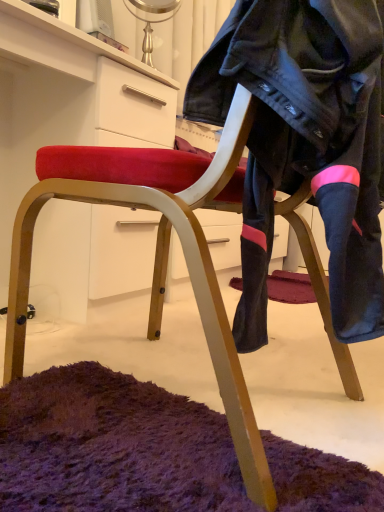
What are the coordinates of `black leather jacket at center` in the screenshot? It's located at (305, 144).

The height and width of the screenshot is (512, 384). What do you see at coordinates (305, 144) in the screenshot?
I see `black leather jacket at center` at bounding box center [305, 144].

Locate an element on the screen. This screenshot has width=384, height=512. velvet red chair at lower left is located at coordinates tap(66, 102).

This screenshot has width=384, height=512. What do you see at coordinates (66, 102) in the screenshot?
I see `velvet red chair at lower left` at bounding box center [66, 102].

This screenshot has width=384, height=512. What are the coordinates of `black leather jacket at center` in the screenshot? It's located at (305, 144).

Does black leather jacket at center appear on the right side of velvet red chair at lower left?

Indeed, black leather jacket at center is positioned on the right side of velvet red chair at lower left.

Which is in front, black leather jacket at center or velvet red chair at lower left?

black leather jacket at center is more forward.

Is point (357, 209) more distant than point (75, 295)?

That is False.

From the image's perspective, which object appears higher, black leather jacket at center or velvet red chair at lower left?

velvet red chair at lower left.

From a real-world perspective, who is located lower, black leather jacket at center or velvet red chair at lower left?

In real-world perspective, velvet red chair at lower left is lower.

Is black leather jacket at center wider than velvet red chair at lower left?

In fact, black leather jacket at center might be narrower than velvet red chair at lower left.

Considering the sizes of black leather jacket at center and velvet red chair at lower left in the image, is black leather jacket at center taller or shorter than velvet red chair at lower left?

Considering their sizes, black leather jacket at center has less height than velvet red chair at lower left.

In terms of size, does black leather jacket at center appear bigger or smaller than velvet red chair at lower left?

black leather jacket at center is smaller than velvet red chair at lower left.

Does black leather jacket at center contain velvet red chair at lower left?

That's incorrect, velvet red chair at lower left is not inside black leather jacket at center.

Would you consider black leather jacket at center to be distant from velvet red chair at lower left?

No, black leather jacket at center is not far from velvet red chair at lower left.

Is black leather jacket at center facing towards velvet red chair at lower left?

Yes, black leather jacket at center faces towards velvet red chair at lower left.

This screenshot has width=384, height=512. I want to click on leather jacket that is in front of the velvet red chair at lower left, so click(305, 144).

Would you say velvet red chair at lower left is to the left or to the right of black leather jacket at center in the picture?

velvet red chair at lower left is to the left of black leather jacket at center.

Which is in front, velvet red chair at lower left or black leather jacket at center?

Positioned in front is black leather jacket at center.

Considering the points (129, 133) and (297, 99), which point is in front, point (129, 133) or point (297, 99)?

Point (297, 99)

From the image's perspective, which is below, velvet red chair at lower left or black leather jacket at center?

From the image's view, black leather jacket at center is below.

From a real-world perspective, is velvet red chair at lower left beneath black leather jacket at center?

Yes, from a real-world perspective, velvet red chair at lower left is beneath black leather jacket at center.

In the scene shown: Does velvet red chair at lower left have a lesser width compared to black leather jacket at center?

No.

Is velvet red chair at lower left taller or shorter than black leather jacket at center?

Considering their sizes, velvet red chair at lower left has more height than black leather jacket at center.

Which of these two, velvet red chair at lower left or black leather jacket at center, is smaller?

With smaller size is black leather jacket at center.

Is velvet red chair at lower left located outside black leather jacket at center?

Yes, velvet red chair at lower left is outside of black leather jacket at center.

Are velvet red chair at lower left and black leather jacket at center located far from each other?

They are positioned close to each other.

Could you tell me if velvet red chair at lower left is facing black leather jacket at center?

Yes, velvet red chair at lower left is aimed at black leather jacket at center.

How many degrees apart are the facing directions of velvet red chair at lower left and black leather jacket at center?

The angular difference between velvet red chair at lower left and black leather jacket at center is 178 degrees.

How far apart are velvet red chair at lower left and black leather jacket at center?

They are 28.30 inches apart.

I want to click on leather jacket above the velvet red chair at lower left (from a real-world perspective), so click(x=305, y=144).

At what (x,y) coordinates should I click in order to perform the action: click on leather jacket in front of the velvet red chair at lower left. Please return your answer as a coordinate pair (x, y). The width and height of the screenshot is (384, 512). Looking at the image, I should click on (305, 144).

I want to click on leather jacket located above the velvet red chair at lower left (from a real-world perspective), so click(305, 144).